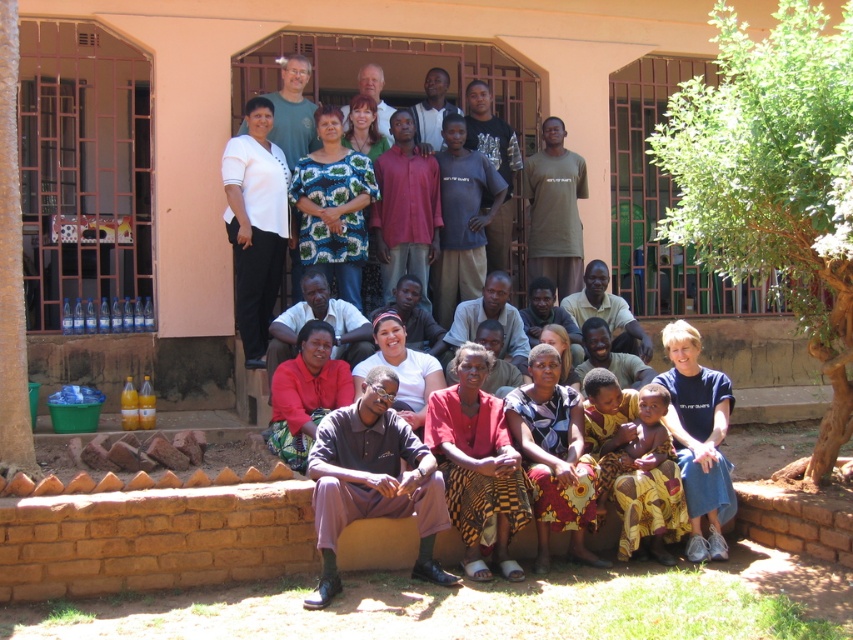
Question: Among these points, which one is nearest to the camera?

Choices:
 (A) (354, 486)
 (B) (428, 292)

Answer: (A)

Question: Which point is farther to the camera?

Choices:
 (A) dark brown fabric pants at lower center
 (B) matte green dress at center

Answer: (B)

Question: Which point is farther to the camera?

Choices:
 (A) (329, 88)
 (B) (395, 384)

Answer: (A)

Question: Does matte green dress at center have a lesser width compared to dark brown fabric pants at lower center?

Choices:
 (A) yes
 (B) no

Answer: (B)

Question: Is matte green dress at center to the right of dark brown fabric pants at lower center from the viewer's perspective?

Choices:
 (A) no
 (B) yes

Answer: (B)

Question: From the image, what is the correct spatial relationship of matte green dress at center in relation to dark brown fabric pants at lower center?

Choices:
 (A) right
 (B) left

Answer: (A)